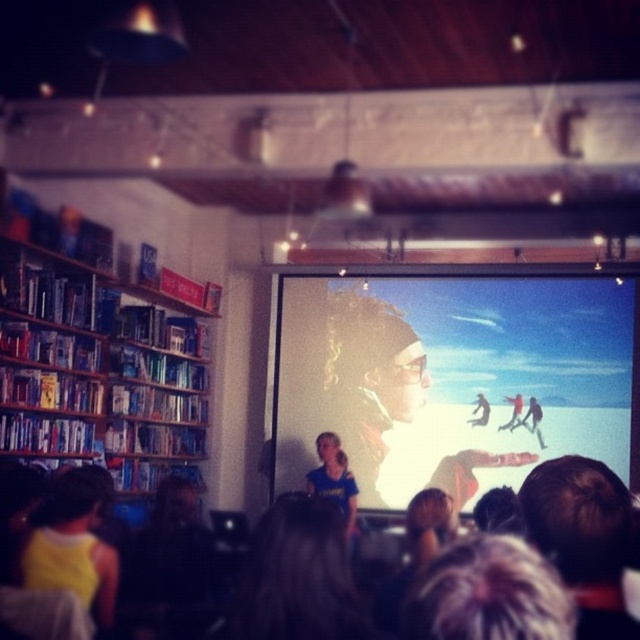
You are an attendee at the presentation and want to take a photo of the presenter. The presenter has dark brown hair at center, and there is a matte black screen at center behind them. Where should you position yourself to ensure both the presenter and the screen are clearly visible in your photo?

You should position yourself to the left of the presenter so that the matte black screen at center is to the right of dark brown hair at center, ensuring both are visible in the frame.